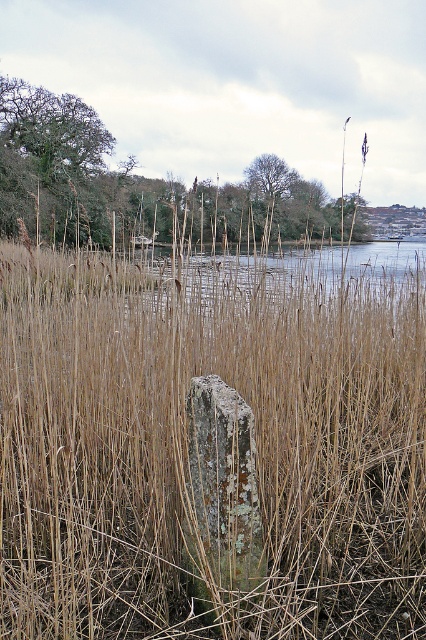
Does brown dry grass at center have a larger size compared to brown reeds at center?

Actually, brown dry grass at center might be smaller than brown reeds at center.

Who is more distant from viewer, (97, 588) or (253, 268)?

The point (253, 268) is behind.

Does point (250, 364) come behind point (222, 273)?

No, (250, 364) is closer to viewer.

I want to click on brown dry grass at center, so click(186, 444).

Who is shorter, brown reeds at center or lichen-covered stone at center?

lichen-covered stone at center

Who is positioned more to the right, brown reeds at center or lichen-covered stone at center?

brown reeds at center

Identify the location of brown reeds at center. (296, 280).

You are a GUI agent. You are given a task and a screenshot of the screen. Output one action in this format:
    pyautogui.click(x=<x>, y=<y>)
    Task: Click on the brown reeds at center
    The height and width of the screenshot is (640, 426).
    Given the screenshot: What is the action you would take?
    pyautogui.click(x=296, y=280)

From the picture: Between brown dry grass at center and lichen-covered stone at center, which one appears on the left side from the viewer's perspective?

brown dry grass at center

Locate an element on the screen. The height and width of the screenshot is (640, 426). brown dry grass at center is located at coordinates click(x=186, y=444).

Identify the location of brown dry grass at center. (186, 444).